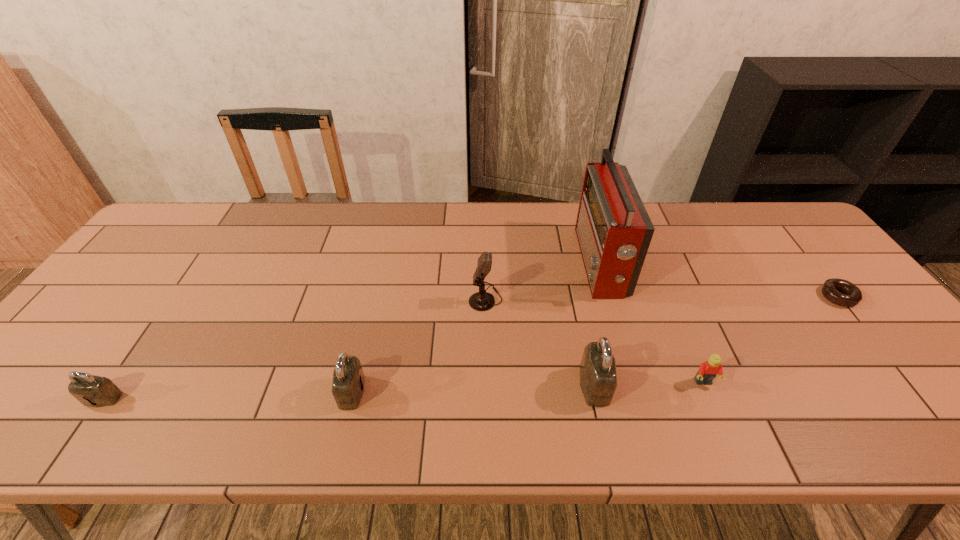
Find the location of `blank space located 0.320m on the back of the rightmost object`. blank space located 0.320m on the back of the rightmost object is located at coordinates (773, 216).

The width and height of the screenshot is (960, 540). Find the location of `object located at the far edge`. object located at the far edge is located at coordinates (613, 229).

Identify the location of Lego at the near edge. (708, 370).

I want to click on object located in the left edge section of the desktop, so click(x=96, y=391).

Where is `object situated at the right edge`? Image resolution: width=960 pixels, height=540 pixels. object situated at the right edge is located at coordinates (852, 295).

Locate an element on the screen. Image resolution: width=960 pixels, height=540 pixels. object situated at the near left corner is located at coordinates (96, 391).

The width and height of the screenshot is (960, 540). In order to click on vacant area at the far edge in this screenshot , I will do `click(208, 239)`.

In the image, there is a desktop. What are the coordinates of `free space at the near edge` in the screenshot? It's located at (837, 384).

I want to click on vacant space at the left edge of the desktop, so click(x=78, y=366).

This screenshot has width=960, height=540. I want to click on vacant point at the right edge, so click(x=828, y=316).